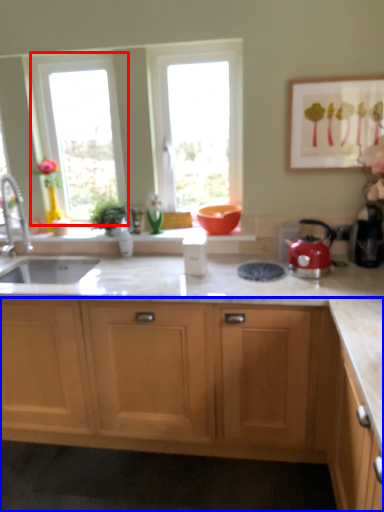
Question: Which object appears farthest to the camera in this image, window (highlighted by a red box) or cabinetry (highlighted by a blue box)?

Choices:
 (A) window
 (B) cabinetry

Answer: (A)